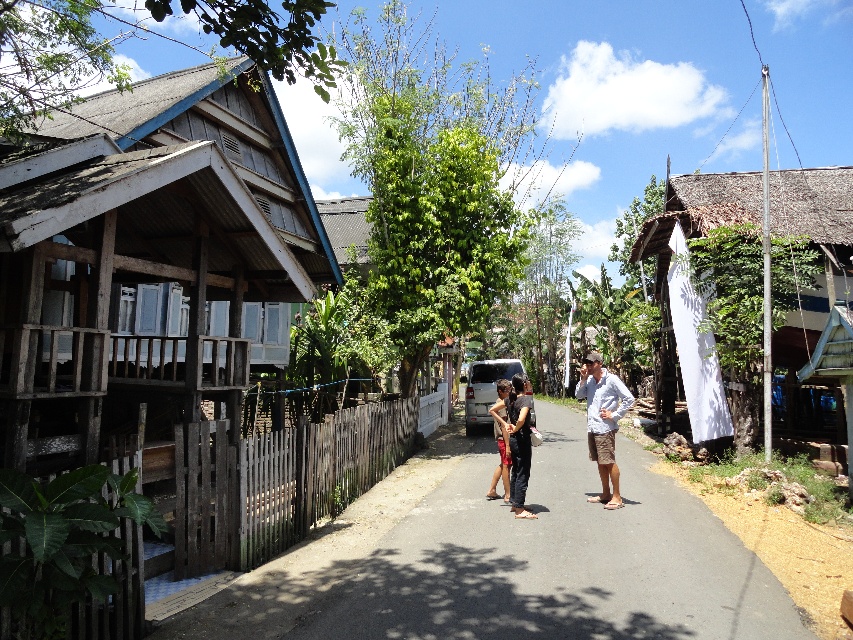
You are a photographer aiming to capture a portrait of a person wearing a light blue shirt at center and dark gray pants at center. To ensure both clothing items are clearly visible, which clothing item should you focus on first considering their widths?

The light blue shirt at center has a greater width than the dark gray pants at center, so focusing on the light blue shirt at center first would ensure its visibility before adjusting for the narrower dark gray pants at center.

You are a delivery person trying to navigate through the rural area shown. You need to pass between the wooden fence at lower left and the dark gray pants at center. Can your delivery cart, which is 1.2 meters wide, fit through the space between them?

The wooden fence at lower left is wider than the dark gray pants at center. The space between them is determined by the narrower object, which is the dark gray pants at center. Since the cart is 1.2 meters wide, and the narrowest point between them is likely wider than the pants, it should fit, but the exact width isna provided. However, based on the description that the fence is wider, the space might be sufficient. Wait, the Objects Description says the fence is larger in width than the pants. So the gap,

You are a delivery person trying to reach the wooden hut at left and the matte black shorts at center. Based on the scene, which object is positioned higher in elevation?

The wooden hut at left is positioned higher in elevation than the matte black shorts at center, as it is described to be above it.